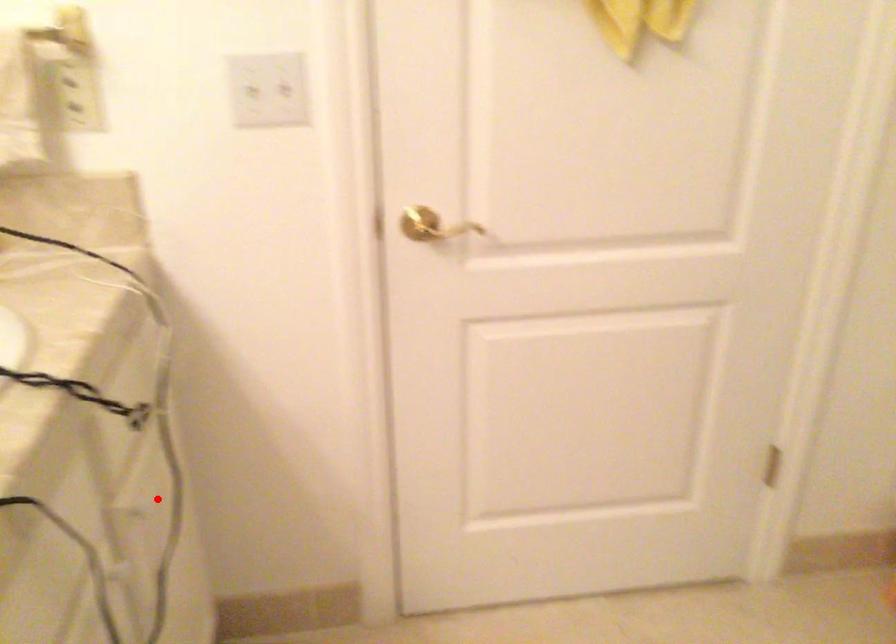
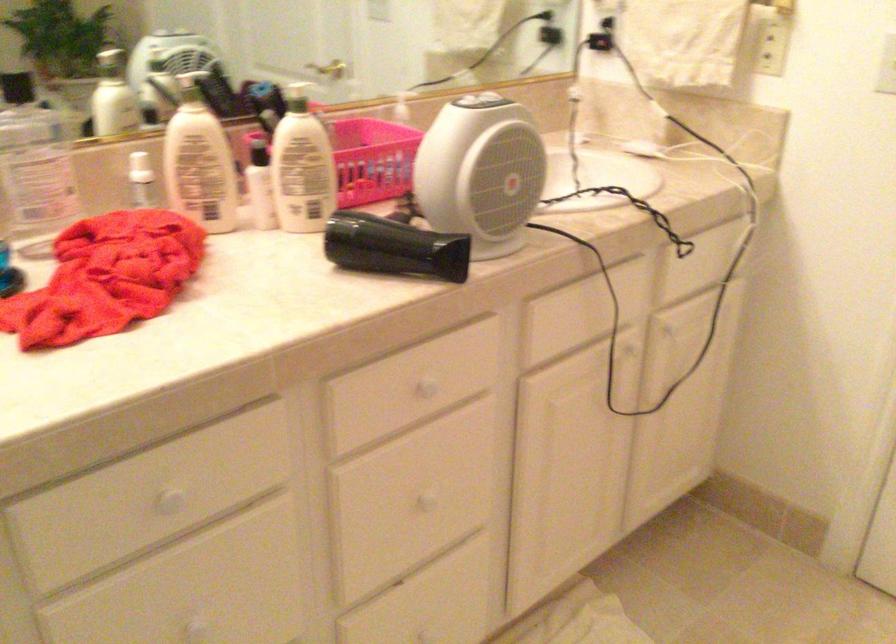
The point at the highlighted location is marked in the first image. Where is the corresponding point in the second image?

(675, 335)